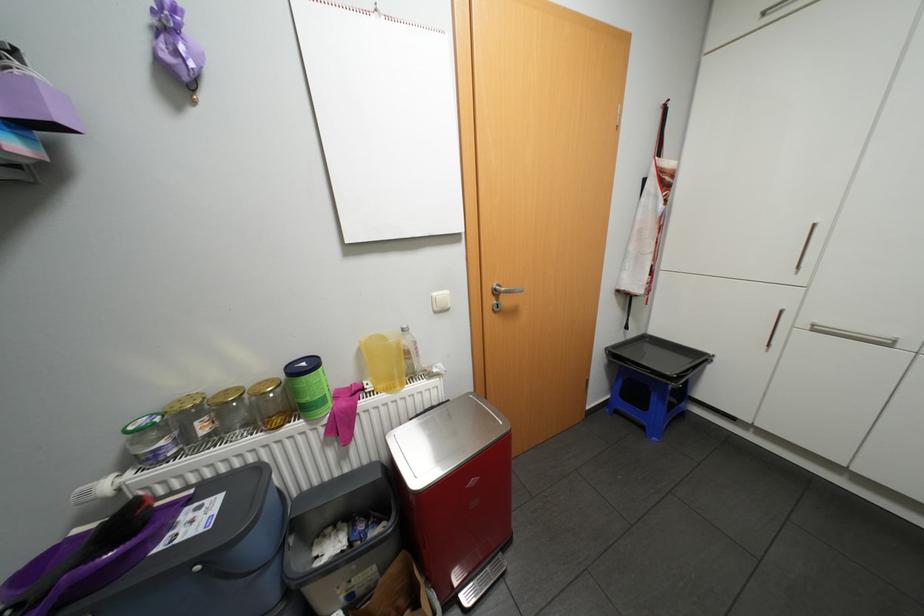
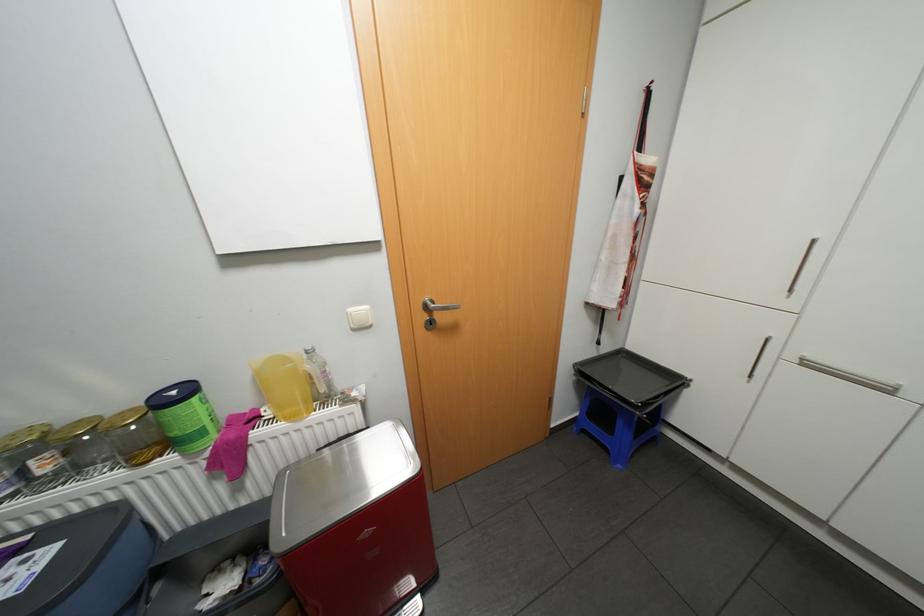
In a continuous first-person perspective shot, in which direction is the camera moving?

The cameraman moved toward right, forward.